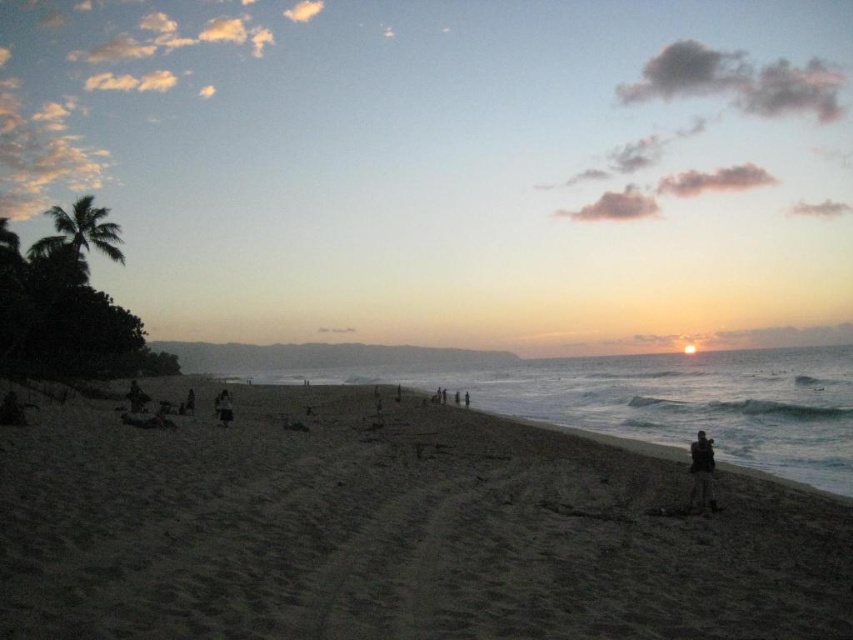
Question: Among these objects, which one is farthest from the camera?

Choices:
 (A) green leafy palm tree at upper left
 (B) silhouette figure at center
 (C) dark skin human at center-left

Answer: (A)

Question: Can you confirm if silhouette figure at center is positioned to the right of dark skin human at center-left?

Choices:
 (A) yes
 (B) no

Answer: (A)

Question: Which point appears farthest from the camera in this image?

Choices:
 (A) (706, 448)
 (B) (229, 404)
 (C) (38, 256)

Answer: (C)

Question: Does green leafy palm tree at upper left appear under dark skin human at center-left?

Choices:
 (A) yes
 (B) no

Answer: (B)

Question: Does green leafy palm tree at upper left have a smaller size compared to dark skin human at center-left?

Choices:
 (A) no
 (B) yes

Answer: (A)

Question: Which point appears farthest from the camera in this image?

Choices:
 (A) (108, 225)
 (B) (836, 556)
 (C) (223, 390)
 (D) (131, 403)

Answer: (C)